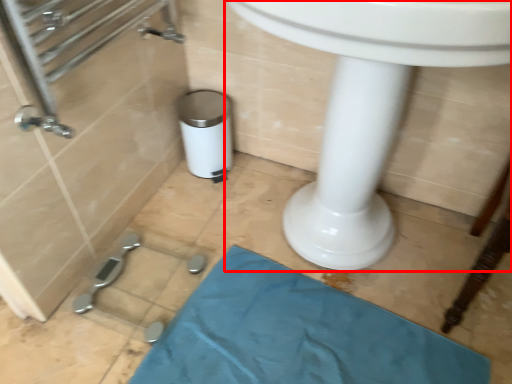
Question: Considering the relative positions of sink (annotated by the red box) and bath mat in the image provided, where is sink (annotated by the red box) located with respect to the staircase?

Choices:
 (A) left
 (B) right

Answer: (B)